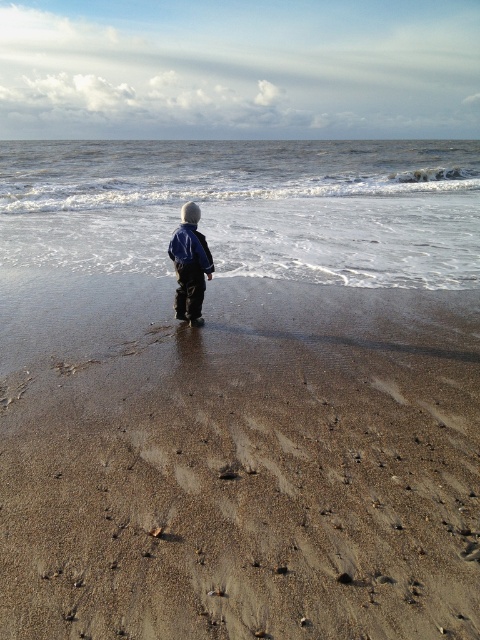
Between white frothy water at center and blue denim jacket at center, which one is positioned higher?

white frothy water at center is above.

Which is below, white frothy water at center or blue denim jacket at center?

blue denim jacket at center is below.

Which is behind, point (285, 182) or point (201, 276)?

The point (285, 182) is behind.

The height and width of the screenshot is (640, 480). I want to click on white frothy water at center, so click(x=249, y=208).

How much distance is there between brown sandy beach at center and blue denim jacket at center?

The distance of brown sandy beach at center from blue denim jacket at center is 14.28 feet.

Does brown sandy beach at center appear over blue denim jacket at center?

Incorrect, brown sandy beach at center is not positioned above blue denim jacket at center.

Does point (315, 397) come in front of point (206, 273)?

Yes, it is in front of point (206, 273).

I want to click on brown sandy beach at center, so click(x=238, y=461).

Measure the distance between point (223,388) and camera.

The distance of point (223,388) from camera is 5.06 meters.

Between point (7, 522) and point (240, 147), which one is positioned behind?

The point (240, 147) is behind.

The width and height of the screenshot is (480, 640). Identify the location of brown sandy beach at center. tap(238, 461).